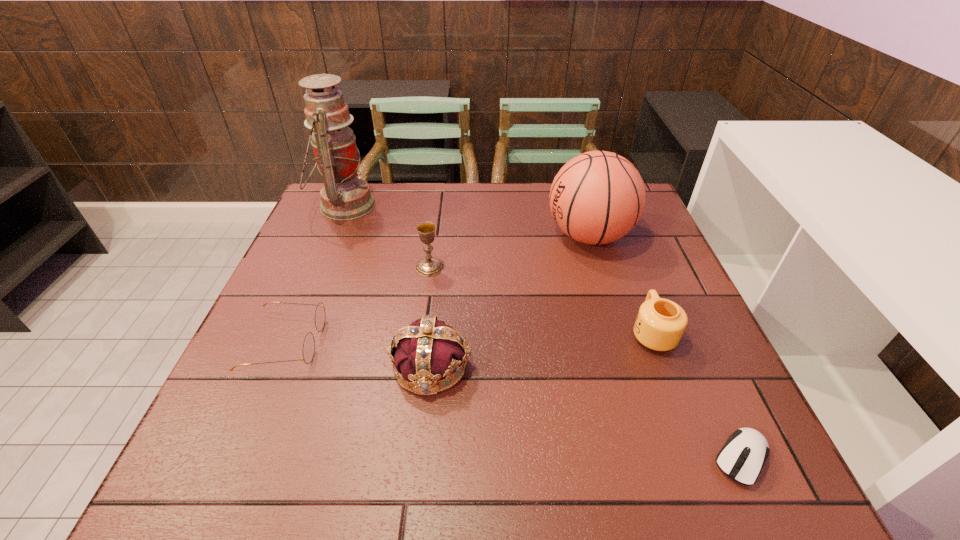
Where is `free region located on the surface of the basketball near the brand logo`? Image resolution: width=960 pixels, height=540 pixels. free region located on the surface of the basketball near the brand logo is located at coordinates pyautogui.click(x=431, y=235).

At what (x,y) coordinates should I click in order to perform the action: click on vacant area situated 0.240m on the surface of the basketball near the brand logo. Please return your answer as a coordinate pair (x, y). This screenshot has width=960, height=540. Looking at the image, I should click on (459, 235).

In order to click on free spot located 0.200m on the front of the chalice in this screenshot , I will do `click(420, 339)`.

Locate an element on the screen. The image size is (960, 540). free space located 0.110m on the back of the crown is located at coordinates (438, 300).

At what (x,y) coordinates should I click in order to perform the action: click on vacant area located 0.150m on the handle side of the third shortest object. Please return your answer as a coordinate pair (x, y). This screenshot has height=540, width=960. Looking at the image, I should click on (628, 268).

You are a GUI agent. You are given a task and a screenshot of the screen. Output one action in this format:
    pyautogui.click(x=<x>, y=<y>)
    Task: Click on the vacant space located 0.200m on the handle side of the third shortest object
    The width and height of the screenshot is (960, 540).
    Given the screenshot: What is the action you would take?
    pyautogui.click(x=623, y=256)

Where is `vacant space located on the handle side of the third shortest object`? This screenshot has height=540, width=960. vacant space located on the handle side of the third shortest object is located at coordinates (x=632, y=279).

You are a GUI agent. You are given a task and a screenshot of the screen. Output one action in this format:
    pyautogui.click(x=<x>, y=<y>)
    Task: Click on the free space located 0.280m on the temples of the second shortest object
    This screenshot has width=960, height=540.
    Given the screenshot: What is the action you would take?
    pyautogui.click(x=453, y=342)

Where is `vacant space located 0.380m on the back of the nearest object`? The height and width of the screenshot is (540, 960). vacant space located 0.380m on the back of the nearest object is located at coordinates (664, 286).

This screenshot has height=540, width=960. I want to click on oil lamp located in the far edge section of the desktop, so click(x=344, y=196).